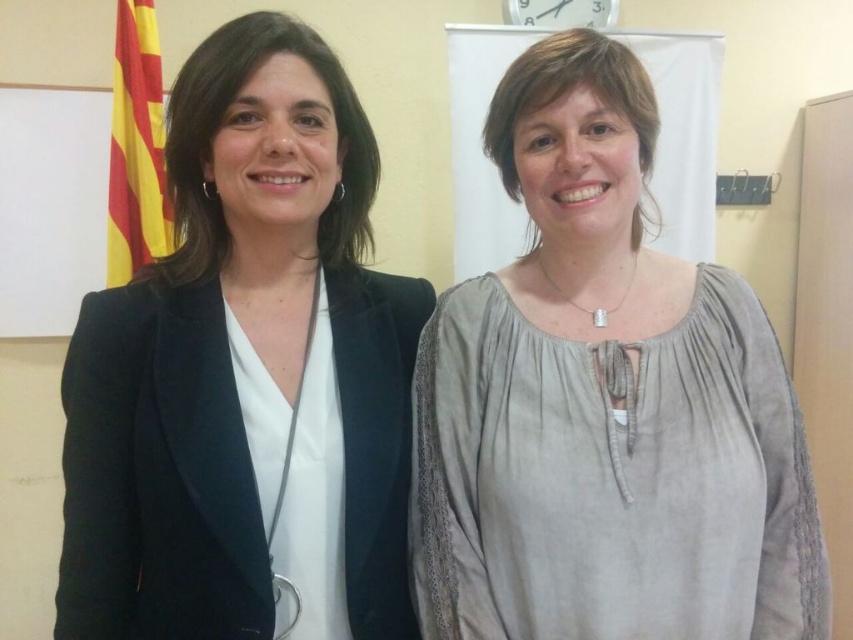
You are a photographer adjusting your camera to focus on two specific points in the image. The points are labeled as point 1 at coordinates (784,541) and point 2 at (376,164). If you want to focus on the point that is closer to you, which point should you choose?

Point 1 at coordinates (784,541) is closer to the viewer than point 2 at (376,164), so you should choose point 1 at coordinates (784,541) to focus on.

You are a photographer trying to adjust the lighting for a portrait. You need to place a spotlight directly above the light gray cotton blouse at center. Given that the camera is positioned at the origin point, what are the coordinates where you should place the spotlight to ensure it is directly above the blouse?

The coordinates for placing the spotlight directly above the light gray cotton blouse at center would be at point [604,403], as this is the 2D location of the blouse in the image.